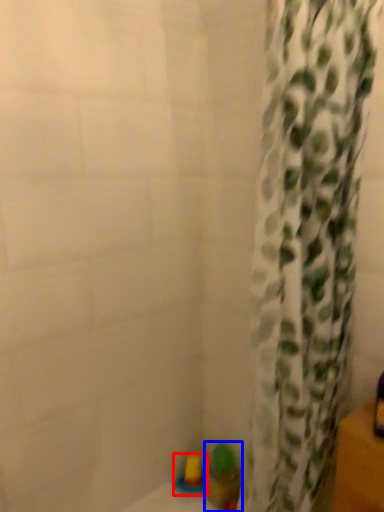
Question: Which object is closer to the camera taking this photo, toy (highlighted by a red box) or toy (highlighted by a blue box)?

Choices:
 (A) toy
 (B) toy

Answer: (B)